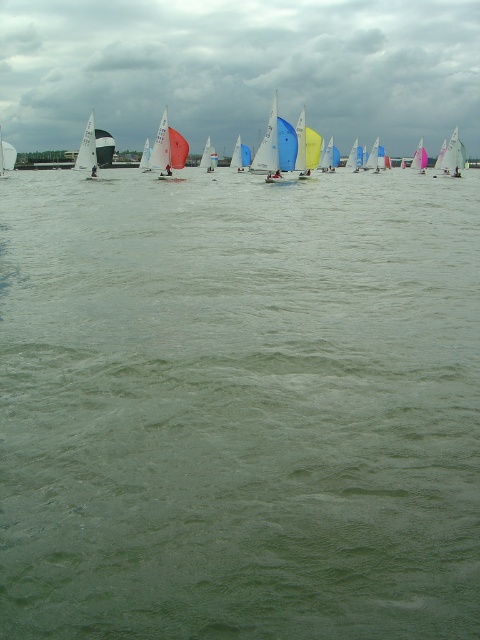
Question: Is white matte sailboat at left positioned behind pink sailboat at upper center?

Choices:
 (A) no
 (B) yes

Answer: (A)

Question: Does green water at center appear on the right side of white matte sailboat at left?

Choices:
 (A) no
 (B) yes

Answer: (B)

Question: Which object is the farthest from the pink sailboat at upper center?

Choices:
 (A) green water at center
 (B) white matte sailboat at left

Answer: (A)

Question: Which of the following is the farthest from the observer?

Choices:
 (A) (417, 157)
 (B) (36, 556)
 (C) (93, 144)

Answer: (A)

Question: Which point appears farthest from the camera in this image?

Choices:
 (A) (84, 144)
 (B) (274, 460)
 (C) (425, 152)

Answer: (C)

Question: Is white matte sailboat at left positioned before pink sailboat at upper center?

Choices:
 (A) no
 (B) yes

Answer: (B)